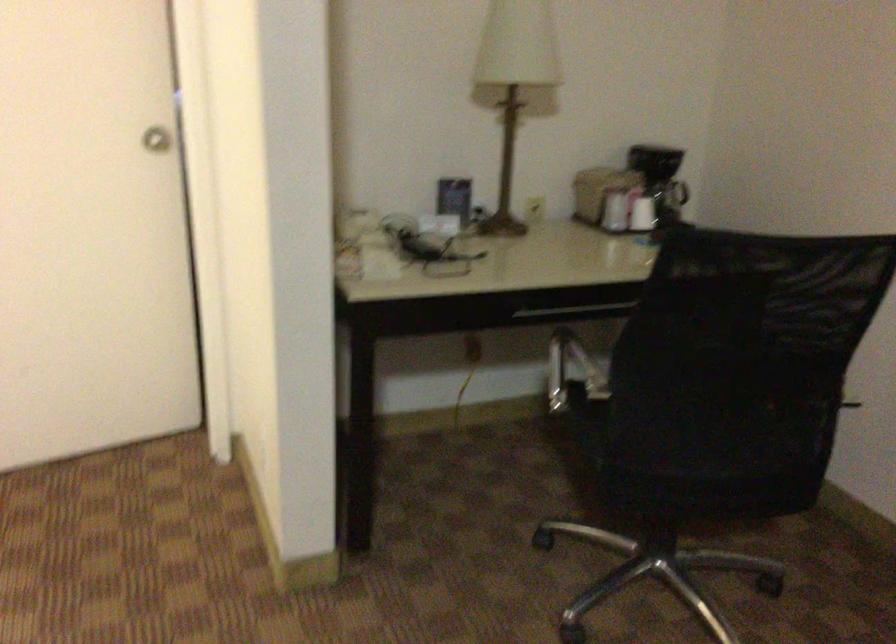
At what (x,y) coordinates should I click in order to perform the action: click on white cup. Please return your answer as a coordinate pair (x, y). Looking at the image, I should click on (642, 214).